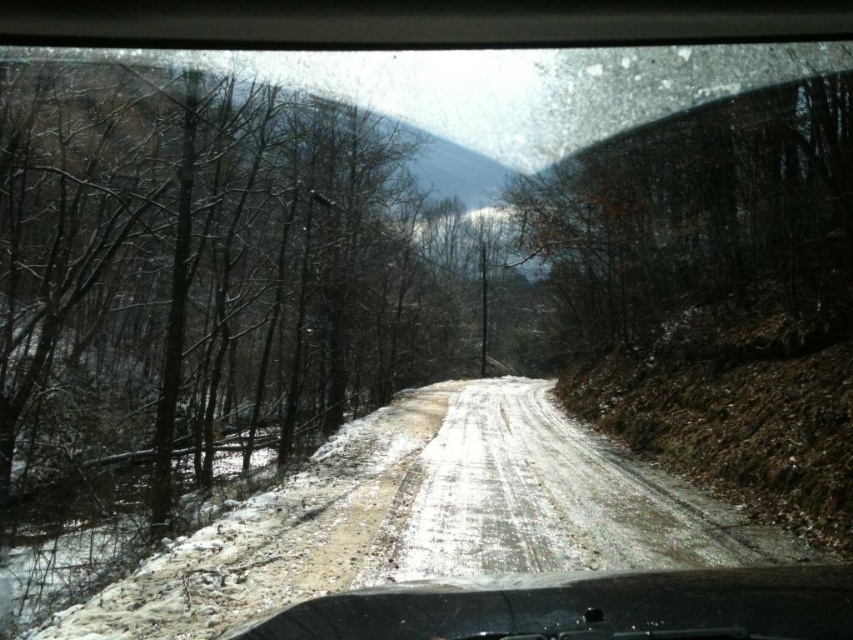
You are driving on a snowy road and need to check your dashboard. While looking at the black rubber dashboard at bottom, you notice a brown matte tree at upper right in your view. Which object is positioned to the right side of your current view?

The brown matte tree at upper right is positioned to the right of the black rubber dashboard at bottom in your current view.